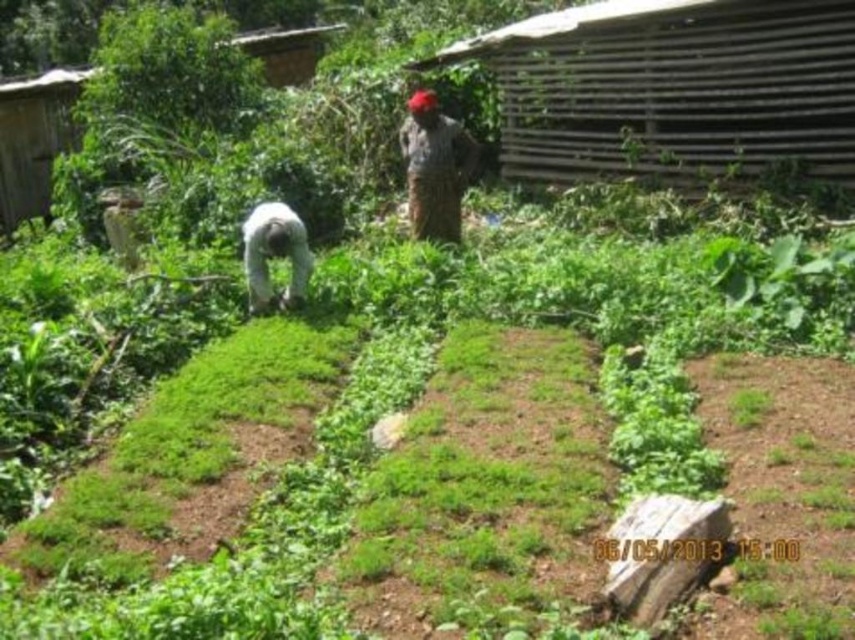
You are a farmer who needs to water the crops between the dark gray fabric at center and the white fabric at center. Your watering can holds 3 liters of water and you can pour 0.5 liters per meter walked. Can you water the entire distance without refilling?

The distance between the dark gray fabric at center and white fabric at center is 2.76 meters. At 0.5 liters per meter, you would need 1.38 liters of water. Since your watering can holds 3 liters, which is more than enough, you can water the entire distance without needing to refill.

You are planning to install a new irrigation system in the garden. The system requires a path that is at least 1 meter wide to accommodate the equipment. Given the dark gray fabric at center and the white fabric at center, which one can be used as the base for this path?

The dark gray fabric at center can be used as the base for the irrigation system path since its width surpasses that of the white fabric at center, meeting the minimum width requirement of 1 meter.

You are a farmer standing at the edge of the garden. You see the dark gray fabric at center and the white fabric at center. Which fabric is closer to you?

The dark gray fabric at center is closer to you because it is further to the viewer than the white fabric at center.